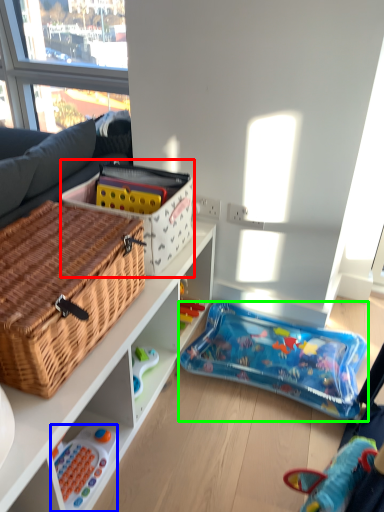
Question: Which object is the farthest from cardboard box (highlighted by a red box)? Choose among these: toy (highlighted by a blue box) or toy (highlighted by a green box).

Choices:
 (A) toy
 (B) toy

Answer: (A)